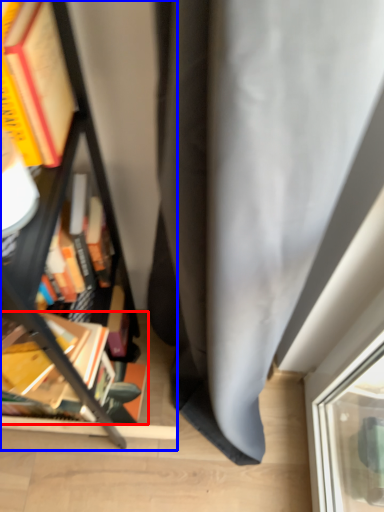
Question: Which object is closer to the camera taking this photo, book (highlighted by a red box) or bookcase (highlighted by a blue box)?

Choices:
 (A) book
 (B) bookcase

Answer: (B)